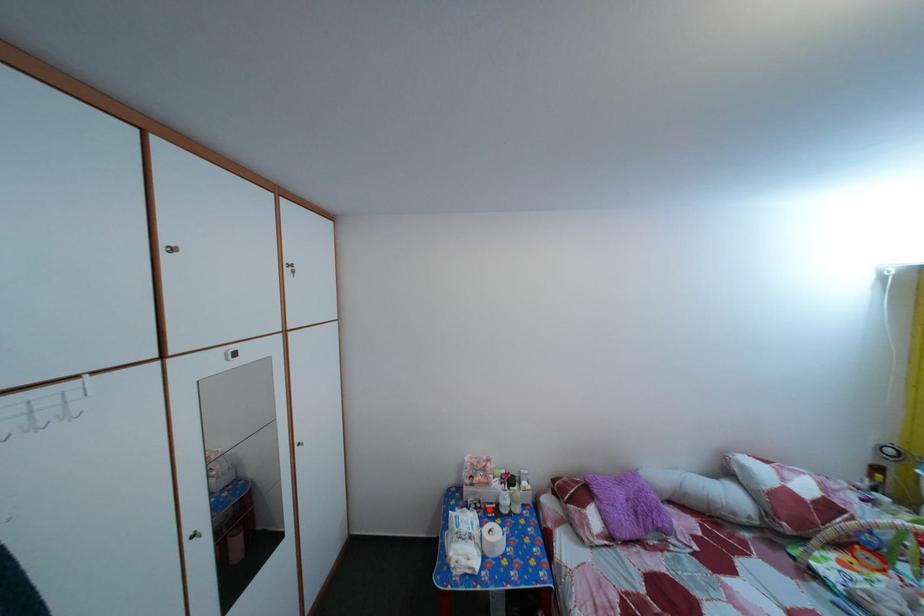
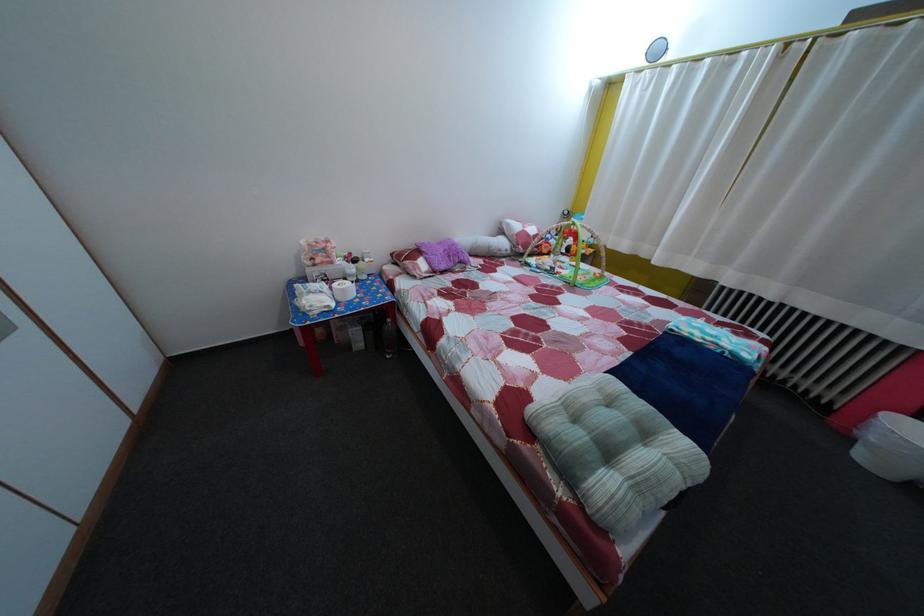
In the second image, find the point that corresponds to the highlighted location in the first image.

(335, 284)